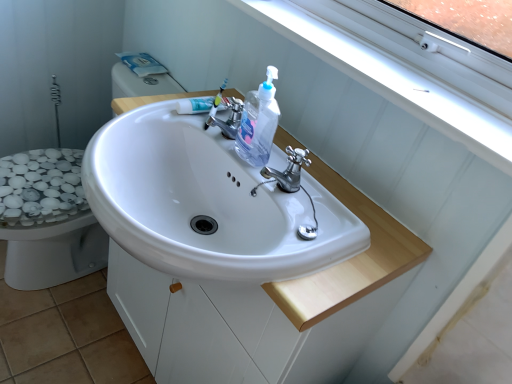
Question: Considering the relative sizes of white plastic toothbrush at center and chrome metallic faucet at center, marked as the first tap in a left-to-right arrangement, in the image provided, is white plastic toothbrush at center bigger than chrome metallic faucet at center, marked as the first tap in a left-to-right arrangement,?

Choices:
 (A) yes
 (B) no

Answer: (B)

Question: Considering the relative positions of white plastic toothbrush at center and chrome metallic faucet at center, which appears as the 2th tap when viewed from the front, in the image provided, is white plastic toothbrush at center to the right of chrome metallic faucet at center, which appears as the 2th tap when viewed from the front, from the viewer's perspective?

Choices:
 (A) no
 (B) yes

Answer: (A)

Question: Does white plastic toothbrush at center come behind chrome metallic faucet at center, which ranks as the first tap in back-to-front order?

Choices:
 (A) yes
 (B) no

Answer: (A)

Question: Would you consider white plastic toothbrush at center to be distant from chrome metallic faucet at center, which ranks as the first tap in back-to-front order?

Choices:
 (A) no
 (B) yes

Answer: (A)

Question: From the image's perspective, is white plastic toothbrush at center on chrome metallic faucet at center, the 1th tap when ordered from top to bottom?

Choices:
 (A) yes
 (B) no

Answer: (A)

Question: From a real-world perspective, is white plastic toothbrush at center physically below chrome metallic faucet at center, positioned as the second tap in bottom-to-top order?

Choices:
 (A) no
 (B) yes

Answer: (B)

Question: From the image's perspective, is white plastic window frame at upper right on top of chrome metallic faucet at center, which ranks as the first tap in back-to-front order?

Choices:
 (A) no
 (B) yes

Answer: (B)

Question: Is white plastic window frame at upper right looking in the opposite direction of chrome metallic faucet at center, positioned as the second tap in bottom-to-top order?

Choices:
 (A) yes
 (B) no

Answer: (B)

Question: Can you confirm if white plastic window frame at upper right is taller than chrome metallic faucet at center, positioned as the second tap in bottom-to-top order?

Choices:
 (A) no
 (B) yes

Answer: (A)

Question: Is white plastic window frame at upper right bigger than chrome metallic faucet at center, which appears as the 2th tap when viewed from the front?

Choices:
 (A) no
 (B) yes

Answer: (B)

Question: Does white plastic window frame at upper right appear on the right side of chrome metallic faucet at center, marked as the first tap in a left-to-right arrangement?

Choices:
 (A) no
 (B) yes

Answer: (B)

Question: From the image's perspective, is white plastic window frame at upper right beneath chrome metallic faucet at center, which is counted as the second tap, starting from the right?

Choices:
 (A) no
 (B) yes

Answer: (A)

Question: Is the position of polished chrome faucet at center, positioned as the 1th tap in bottom-to-top order, more distant than that of white glossy sink at center?

Choices:
 (A) yes
 (B) no

Answer: (A)